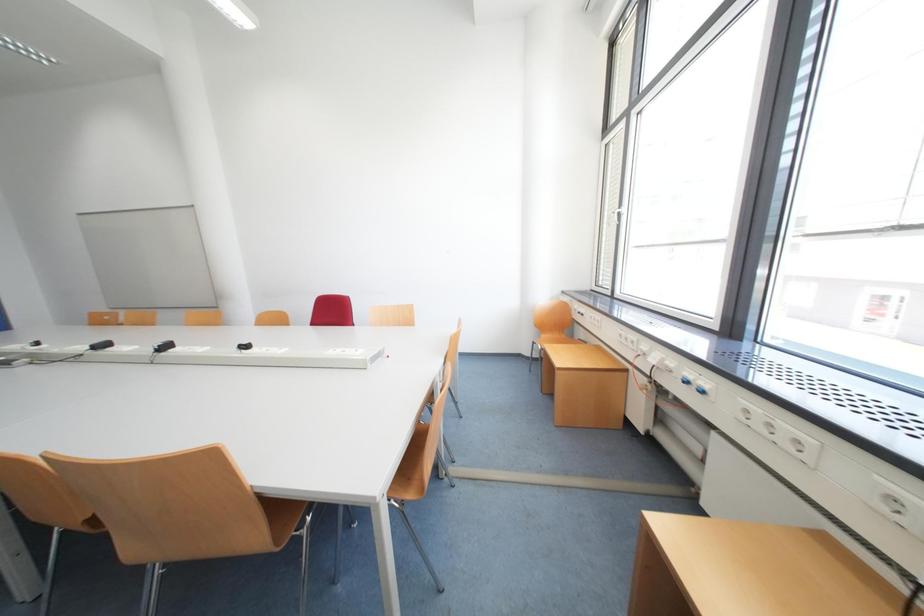
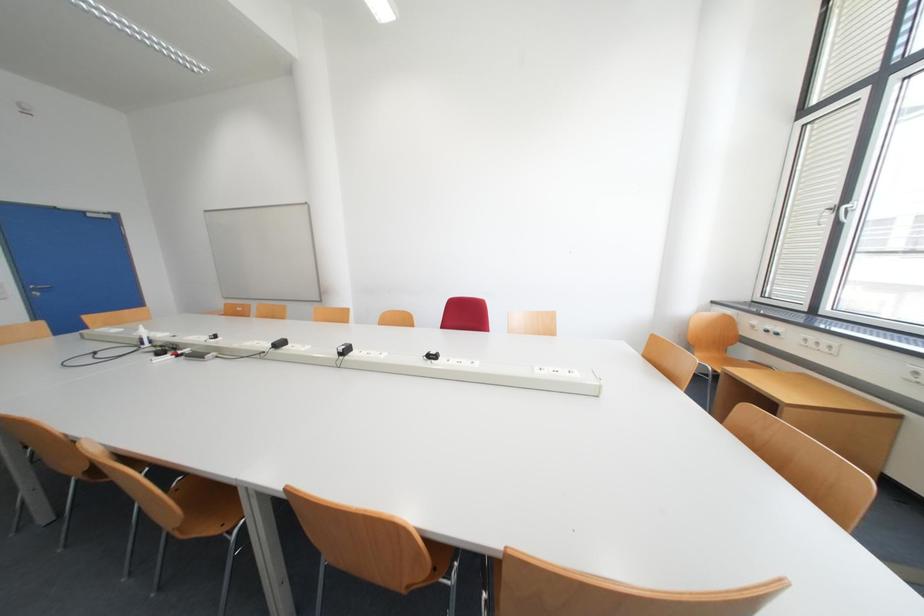
Question: Which direction would the cameraman need to move to produce the second image? Reply with the corresponding letter.

Choices:
 (A) Left
 (B) Right
 (C) Forward
 (D) Backward

Answer: (A)